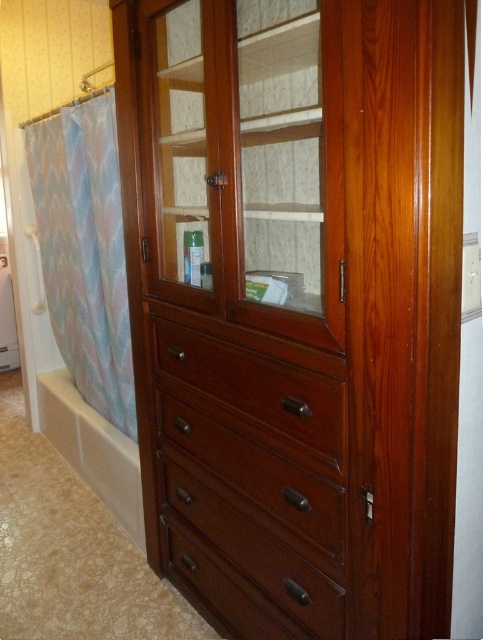
Question: Which object is closer to the camera taking this photo?

Choices:
 (A) transparent wood cabinet at center
 (B) dark wood drawer at center
 (C) white glossy bathtub at lower left
 (D) pastel fabric shower curtain at left

Answer: (A)

Question: Is polished wood armoire at center positioned in front of white glossy bathtub at lower left?

Choices:
 (A) yes
 (B) no

Answer: (A)

Question: Which of these objects is positioned closest to the polished wood armoire at center?

Choices:
 (A) pastel fabric shower curtain at left
 (B) dark wood drawer at center

Answer: (B)

Question: Which point is farther to the camera?

Choices:
 (A) mahogany drawer at center
 (B) white glossy bathtub at lower left
 (C) pastel fabric shower curtain at left
 (D) polished wood armoire at center

Answer: (B)

Question: Is the position of polished wood armoire at center more distant than that of dark wood drawer at center?

Choices:
 (A) yes
 (B) no

Answer: (B)

Question: Can you confirm if pastel fabric shower curtain at left is positioned below white glossy bathtub at lower left?

Choices:
 (A) no
 (B) yes

Answer: (A)